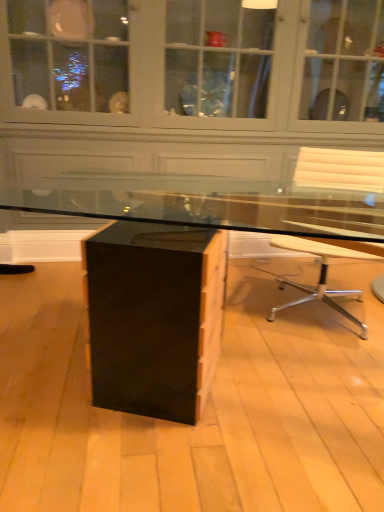
I want to click on unoccupied area behind white leather chair at right, so click(281, 273).